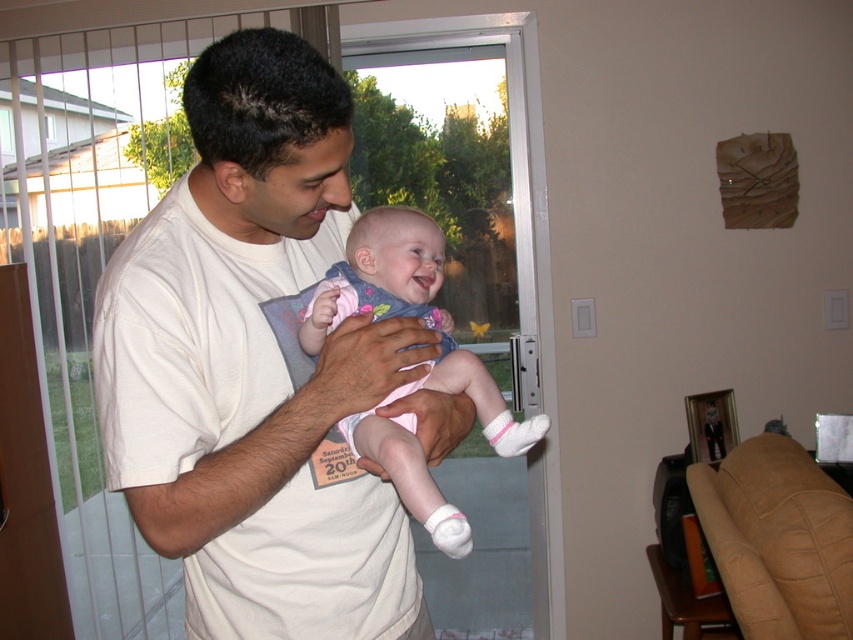
You are a photographer trying to capture a candid shot of the white cotton shirt at center and the pink fabric baby at center. Since you want to ensure both subjects are in focus, you need to know their relative sizes. Which object is bigger?

The white cotton shirt at center is larger in size compared to the pink fabric baby at center, so you should adjust your camera settings to accommodate the size difference for optimal focus.

You are a photographer positioned in the living room and want to take a clear photo of the white cotton shirt at center and the pink fabric baby at center. Which object should you focus on first to ensure both are in focus?

The white cotton shirt at center is closer to the viewer than the pink fabric baby at center, so you should focus on the white cotton shirt at center first to ensure both are in focus.

You are a photographer standing in the living room and want to take a photo of the white cotton shirt at center. Where should you position yourself to capture the shirt in the frame?

To capture the white cotton shirt at center in the frame, position yourself facing the center of the living room, as the shirt is located at the coordinates 0.572 on the x axis and 0.298 on the y axis.